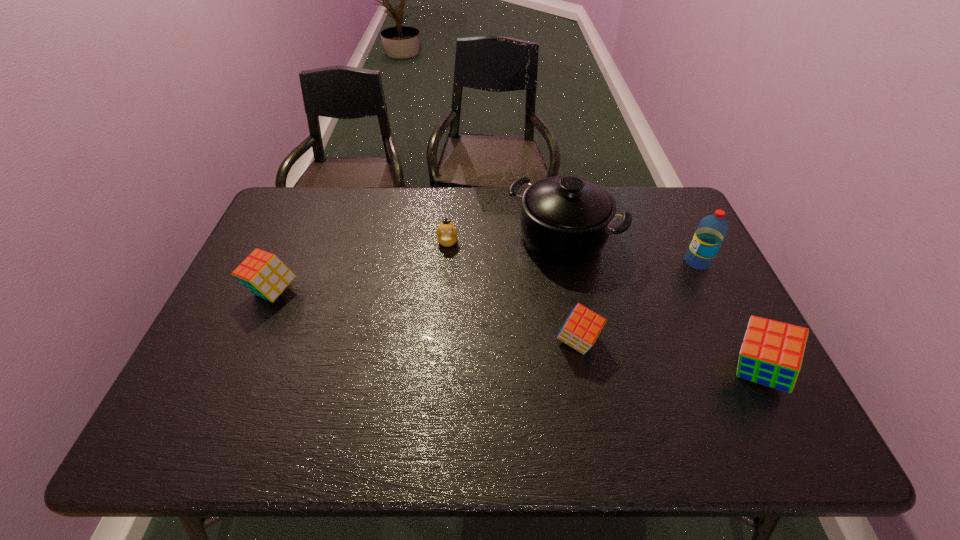
Locate an element on the screen. vacant area in the image that satisfies the following two spatial constraints: 1. on the back side of the saucepan; 2. on the right side of the second cube from left to right is located at coordinates (559, 239).